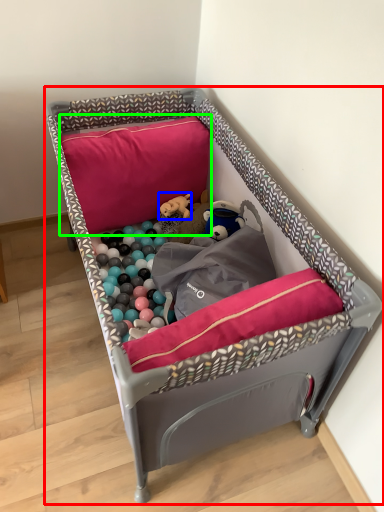
Question: Estimate the real-world distances between objects in this image. Which object is closer to infant bed (highlighted by a red box), toy (highlighted by a blue box) or pillow (highlighted by a green box)?

Choices:
 (A) toy
 (B) pillow

Answer: (B)